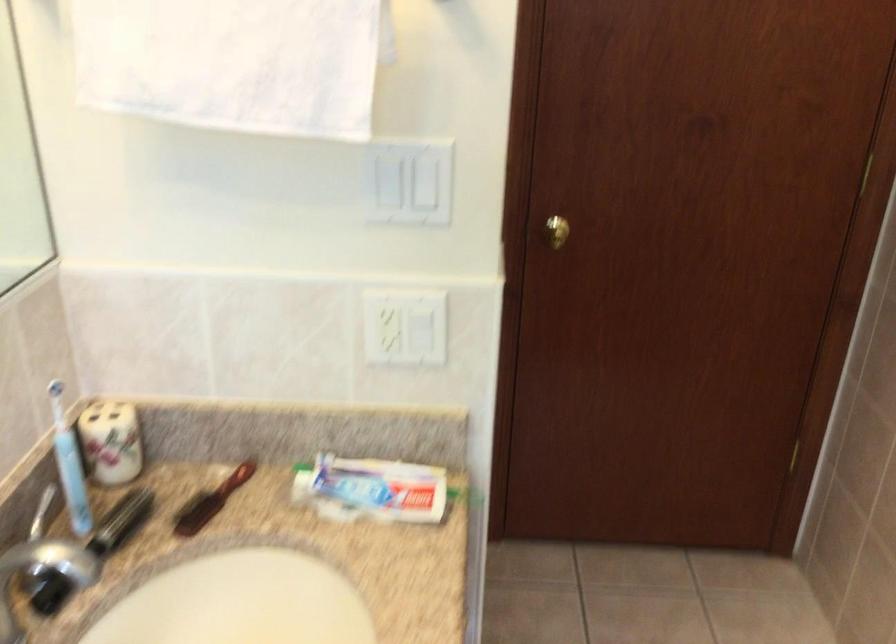
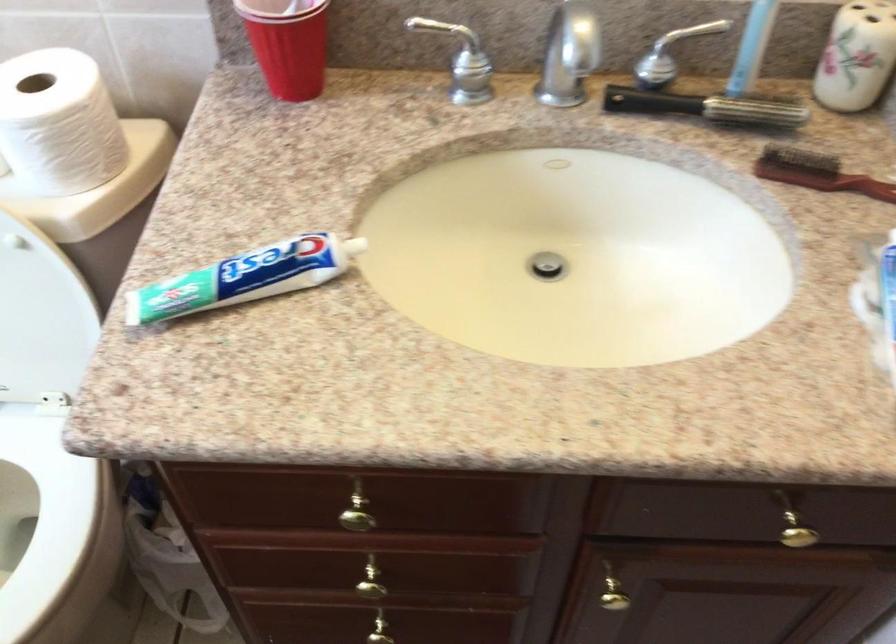
Find the pixel in the second image that matches pixel 203 503 in the first image.

(816, 173)